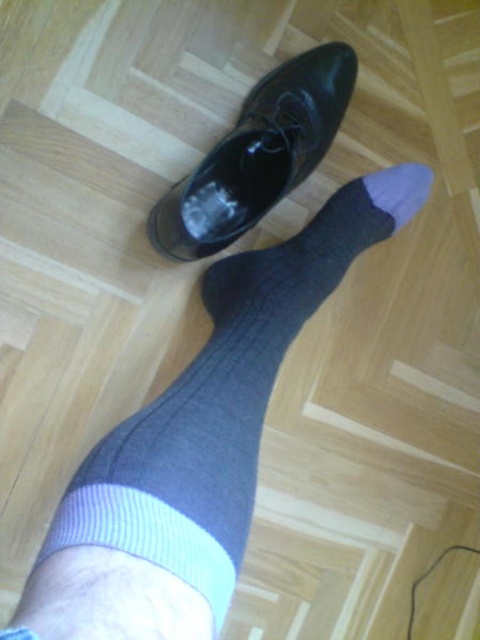
Which is behind, point (354, 209) or point (371, 193)?

Point (371, 193)

Looking at this image, does gray ribbed sock at center appear under gray knitted sock at center?

Yes, gray ribbed sock at center is below gray knitted sock at center.

Between point (241, 403) and point (399, 209), which one is positioned behind?

The point (399, 209) is behind.

The width and height of the screenshot is (480, 640). I want to click on gray ribbed sock at center, so click(208, 417).

Can you confirm if gray ribbed sock at center is thinner than shiny black shoe at center?

Incorrect, gray ribbed sock at center's width is not less than shiny black shoe at center's.

This screenshot has height=640, width=480. What do you see at coordinates (208, 417) in the screenshot? I see `gray ribbed sock at center` at bounding box center [208, 417].

This screenshot has height=640, width=480. Find the location of `gray ribbed sock at center`. gray ribbed sock at center is located at coordinates (208, 417).

Between shiny black shoe at center and gray knitted sock at center, which one appears on the left side from the viewer's perspective?

shiny black shoe at center is more to the left.

Identify the location of shiny black shoe at center. (257, 154).

The width and height of the screenshot is (480, 640). Find the location of `shiny black shoe at center`. shiny black shoe at center is located at coordinates (257, 154).